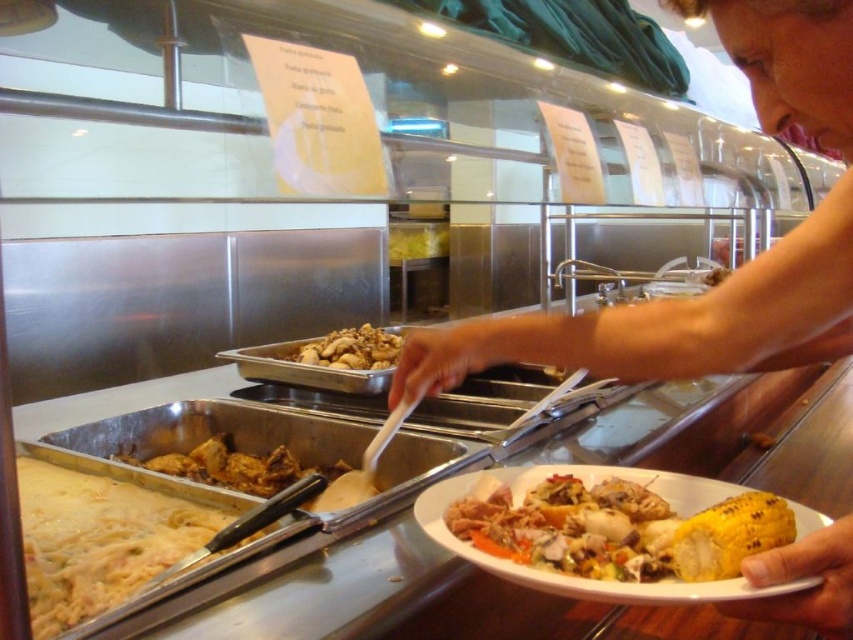
You are a food service attendant who needs to rearrange the food trays to ensure social distancing between the grilled yellow corn at lower right and the golden brown crispy chicken at center. The minimum required distance is 30 inches. Can you confirm if they are currently spaced appropriately?

The grilled yellow corn at lower right and golden brown crispy chicken at center are currently 27.12 inches apart, which is less than the required 30 inches for social distancing. They need to be moved further apart to meet the requirement.

You are a food service worker who needs to place a new corn cob on the table at the same distance as the existing grilled yellow corn at lower right. What distance should you maintain from the viewer?

The grilled yellow corn at lower right is positioned at a distance of 19.52 inches from the viewer, so you should place the new corn cob at the same distance of 19.52 inches from the viewer.